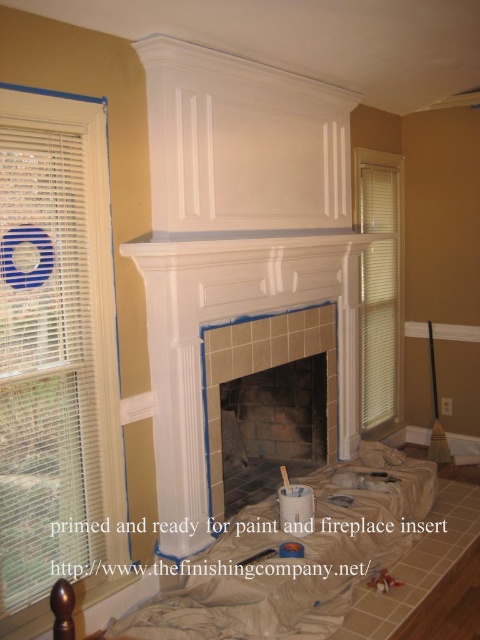
Question: Which point is farther to the camera?

Choices:
 (A) (212, 234)
 (B) (73, 218)
 (C) (361, 253)

Answer: (C)

Question: Among these points, which one is farthest from the camera?

Choices:
 (A) (289, 314)
 (B) (286, 237)

Answer: (A)

Question: Does white tile fireplace at center lie in front of white glossy mantle at center?

Choices:
 (A) yes
 (B) no

Answer: (B)

Question: Estimate the real-world distances between objects in this image. Which object is closer to the white blinds at left?

Choices:
 (A) beige/textured blinds at right
 (B) white glossy mantle at center

Answer: (B)

Question: Considering the relative positions of beige/textured blinds at right and white tile fireplace at center in the image provided, where is beige/textured blinds at right located with respect to white tile fireplace at center?

Choices:
 (A) right
 (B) left

Answer: (A)

Question: Does white tile fireplace at center come behind white glossy mantle at center?

Choices:
 (A) yes
 (B) no

Answer: (A)